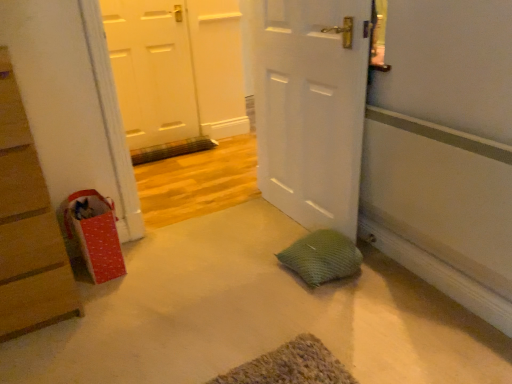
You are a GUI agent. You are given a task and a screenshot of the screen. Output one action in this format:
    pyautogui.click(x=<x>, y=<y>)
    Task: Click on the vacant area located to the right-hand side of green mesh pillow at center
    The image size is (512, 384).
    Given the screenshot: What is the action you would take?
    click(x=376, y=275)